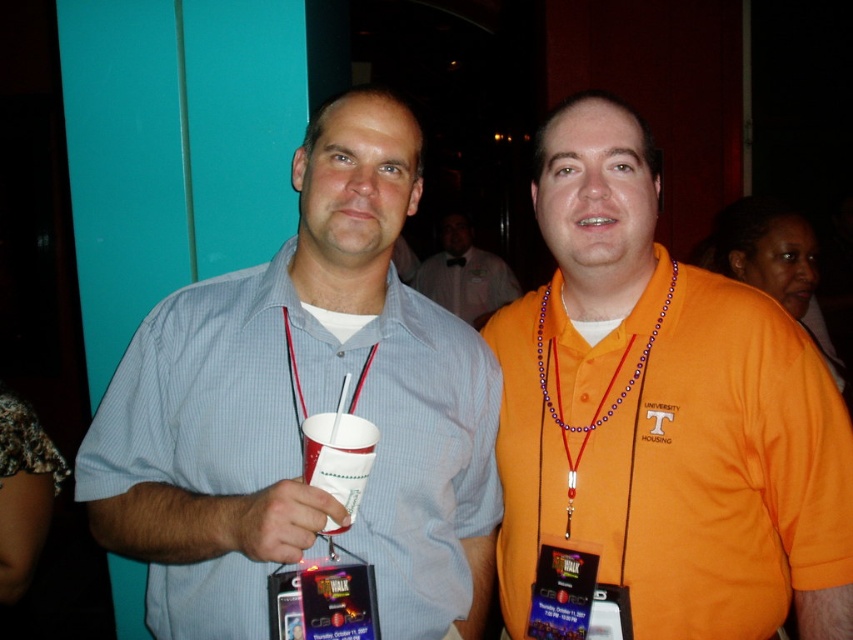
Which is in front, point (793, 401) or point (332, 493)?

Positioned in front is point (332, 493).

Can you confirm if orange cotton shirt at center is shorter than white paper cup at center?

Incorrect, orange cotton shirt at center's height does not fall short of white paper cup at center's.

Find the location of a particular element. Image resolution: width=853 pixels, height=640 pixels. orange cotton shirt at center is located at coordinates (659, 422).

Identify the location of orange cotton shirt at center. (659, 422).

Is orange cotton shirt at center to the right of purple beaded necklace at center from the viewer's perspective?

Correct, you'll find orange cotton shirt at center to the right of purple beaded necklace at center.

Between orange cotton shirt at center and purple beaded necklace at center, which one is positioned higher?

orange cotton shirt at center

Where is `orange cotton shirt at center`? This screenshot has width=853, height=640. orange cotton shirt at center is located at coordinates (659, 422).

What are the coordinates of `orange cotton shirt at center` in the screenshot? It's located at (659, 422).

The width and height of the screenshot is (853, 640). What are the coordinates of `orange cotton shirt at center` in the screenshot? It's located at (659, 422).

Between orange cotton shirt at center and matte blue shirt at center, which one has more height?

Standing taller between the two is matte blue shirt at center.

Where is `orange cotton shirt at center`? This screenshot has width=853, height=640. orange cotton shirt at center is located at coordinates (659, 422).